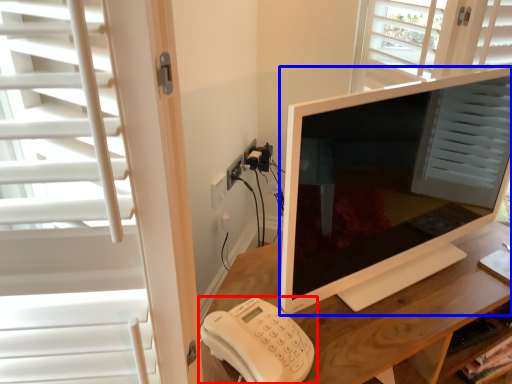
Question: Which of the following is the closest to the observer, corded phone (highlighted by a red box) or television (highlighted by a blue box)?

Choices:
 (A) corded phone
 (B) television

Answer: (B)